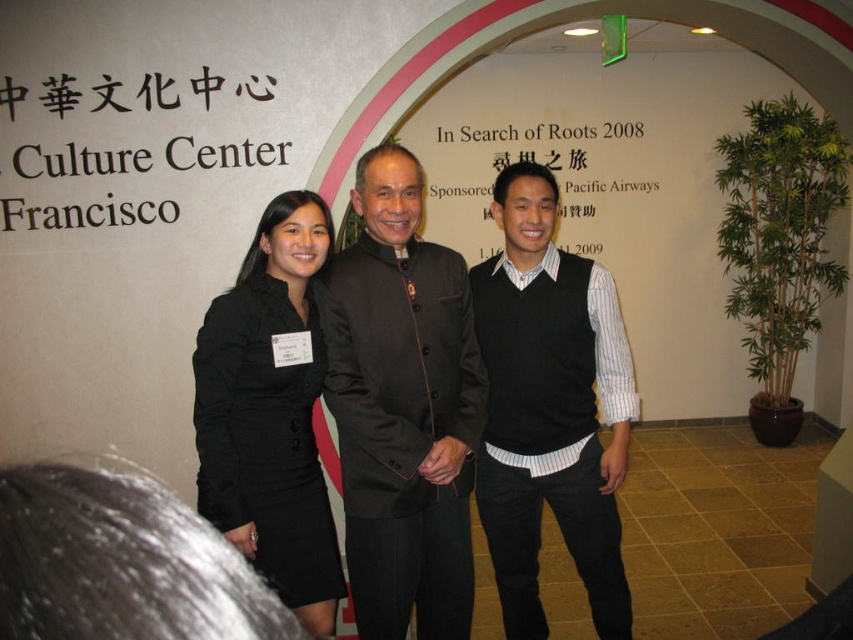
Question: Does dark brown satin jacket at center have a smaller size compared to black knit vest at center?

Choices:
 (A) yes
 (B) no

Answer: (A)

Question: Which point is farther to the camera?

Choices:
 (A) black knit vest at center
 (B) black satin dress at center

Answer: (A)

Question: Is dark brown satin jacket at center bigger than black knit vest at center?

Choices:
 (A) no
 (B) yes

Answer: (A)

Question: Which of the following is the farthest from the observer?

Choices:
 (A) black satin dress at center
 (B) black knit vest at center

Answer: (B)

Question: Is the position of dark brown satin jacket at center less distant than that of black knit vest at center?

Choices:
 (A) no
 (B) yes

Answer: (B)

Question: Which object appears closest to the camera in this image?

Choices:
 (A) dark brown satin jacket at center
 (B) black satin dress at center
 (C) black knit vest at center

Answer: (B)